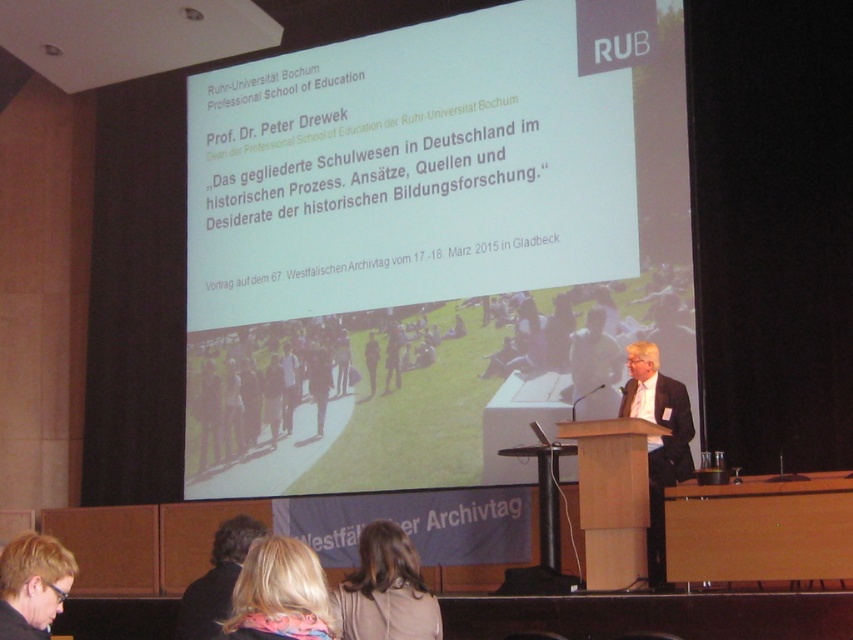
Which is more to the left, white paper at upper center or blonde hair at lower center?

blonde hair at lower center

You are a GUI agent. You are given a task and a screenshot of the screen. Output one action in this format:
    pyautogui.click(x=<x>, y=<y>)
    Task: Click on the white paper at upper center
    The width and height of the screenshot is (853, 640).
    Given the screenshot: What is the action you would take?
    pyautogui.click(x=432, y=244)

Identify the location of white paper at upper center. (432, 244).

Can you confirm if blonde hair scarf at lower center is wider than dark brown hair at lower center?

No, blonde hair scarf at lower center is not wider than dark brown hair at lower center.

The image size is (853, 640). I want to click on blonde hair scarf at lower center, so click(x=279, y=593).

Find the location of a particular element. The width and height of the screenshot is (853, 640). blonde hair scarf at lower center is located at coordinates (279, 593).

Who is shorter, blonde hair at lower center or light brown leather jacket at center?

blonde hair at lower center

Between blonde hair at lower center and light brown leather jacket at center, which one has more height?

Standing taller between the two is light brown leather jacket at center.

Is point (421, 618) in front of point (263, 387)?

Yes, it is in front of point (263, 387).

Identify the location of blonde hair at lower center. (386, 589).